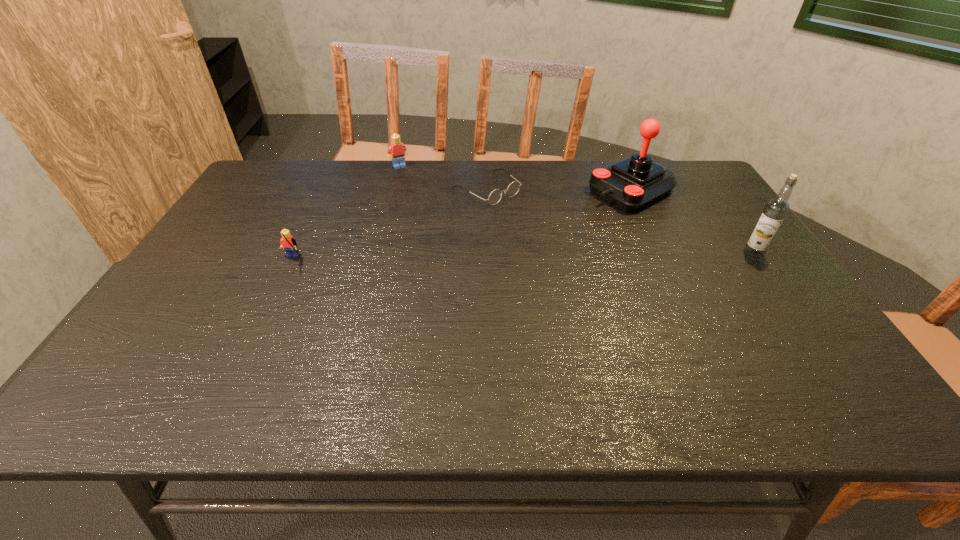
Locate an element on the screen. free space located 0.060m on the base of the joystick is located at coordinates (588, 211).

Find the location of a particular element. The width and height of the screenshot is (960, 540). spectacles present at the far edge is located at coordinates (495, 196).

Find the location of a particular element. The image size is (960, 540). Lego that is at the far edge is located at coordinates (397, 151).

Image resolution: width=960 pixels, height=540 pixels. I want to click on joystick that is at the far edge, so click(631, 184).

At what (x,y) coordinates should I click in order to perform the action: click on vodka that is at the right edge. Please return your answer as a coordinate pair (x, y). This screenshot has width=960, height=540. Looking at the image, I should click on (776, 209).

Image resolution: width=960 pixels, height=540 pixels. Identify the location of joystick located at the right edge. (631, 184).

Where is `object that is at the far right corner`? The height and width of the screenshot is (540, 960). object that is at the far right corner is located at coordinates (631, 184).

The image size is (960, 540). In the image, there is a desktop. Identify the location of vacant region at the far edge. (517, 176).

You are a GUI agent. You are given a task and a screenshot of the screen. Output one action in this format:
    pyautogui.click(x=<x>, y=<y>)
    Task: Click on the free space at the near edge of the desktop
    
    Given the screenshot: What is the action you would take?
    pyautogui.click(x=547, y=350)

You are a GUI agent. You are given a task and a screenshot of the screen. Output one action in this format:
    pyautogui.click(x=<x>, y=<y>)
    Task: Click on the blank space at the left edge of the desktop
    
    Given the screenshot: What is the action you would take?
    pyautogui.click(x=225, y=263)